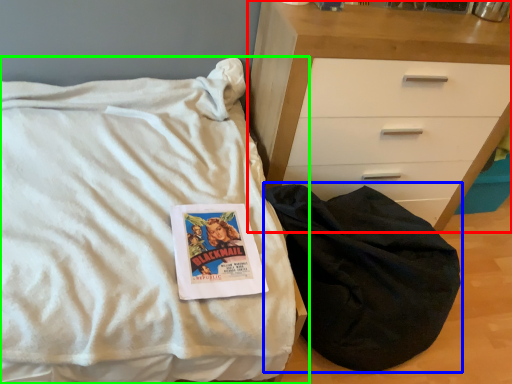
Question: Which is farther away from chest of drawers (highlighted by a red box)? sleeping bag (highlighted by a blue box) or bed (highlighted by a green box)?

Choices:
 (A) sleeping bag
 (B) bed

Answer: (B)